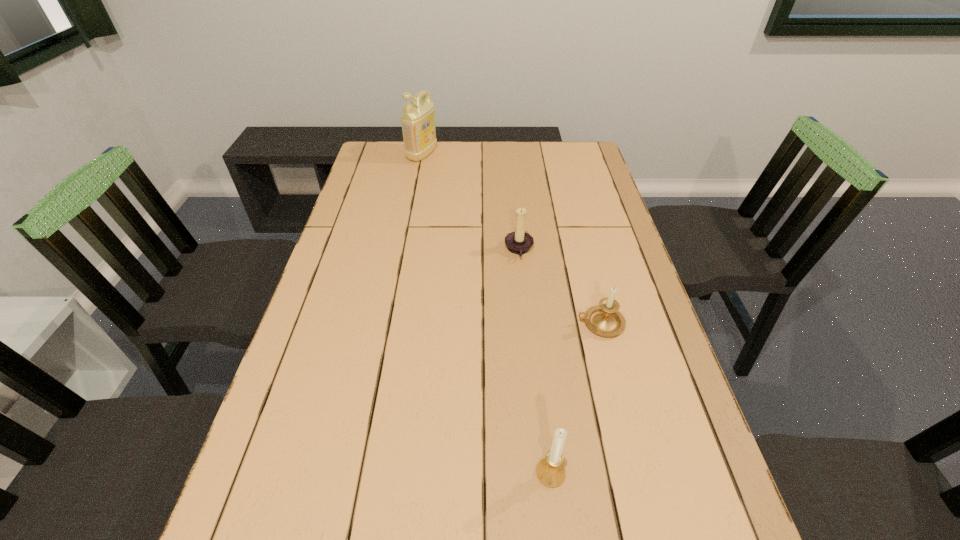
Locate an element on the screen. Image resolution: width=960 pixels, height=540 pixels. free space located on the wick of the second farthest object is located at coordinates (453, 250).

Find the location of a particular element. vacant space located 0.320m with a handle on the side of the second nearest candle holder is located at coordinates (446, 323).

Where is `free location located 0.270m with a handle on the side of the second nearest candle holder`? free location located 0.270m with a handle on the side of the second nearest candle holder is located at coordinates (467, 323).

This screenshot has height=540, width=960. I want to click on blank area located 0.320m with a handle on the side of the second nearest candle holder, so click(x=446, y=323).

Identify the location of object present at the far edge. This screenshot has width=960, height=540. (418, 118).

This screenshot has width=960, height=540. What are the coordinates of `object located at the left edge` in the screenshot? It's located at (418, 118).

Identify the location of object located at the right edge. (604, 319).

The height and width of the screenshot is (540, 960). In order to click on object that is positioned at the far left corner in this screenshot , I will do `click(418, 118)`.

I want to click on vacant region at the far edge, so click(x=544, y=159).

You are a GUI agent. You are given a task and a screenshot of the screen. Output one action in this format:
    pyautogui.click(x=<x>, y=<y>)
    Task: Click on the blank space at the left edge of the desktop
    This screenshot has width=960, height=540.
    Given the screenshot: What is the action you would take?
    pyautogui.click(x=355, y=230)